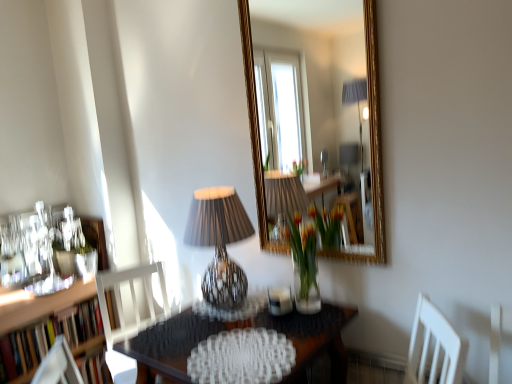
Question: From a real-world perspective, is translucent glass vase at center located higher than matte black lampshade at center?

Choices:
 (A) no
 (B) yes

Answer: (A)

Question: Does translucent glass vase at center appear on the left side of matte black lampshade at center?

Choices:
 (A) no
 (B) yes

Answer: (A)

Question: From the image's perspective, is translucent glass vase at center on top of matte black lampshade at center?

Choices:
 (A) yes
 (B) no

Answer: (B)

Question: Can you confirm if translucent glass vase at center is smaller than matte black lampshade at center?

Choices:
 (A) no
 (B) yes

Answer: (B)

Question: Is translucent glass vase at center oriented away from matte black lampshade at center?

Choices:
 (A) no
 (B) yes

Answer: (A)

Question: Is translucent glass vase at center taller than matte black lampshade at center?

Choices:
 (A) no
 (B) yes

Answer: (A)

Question: Is translucent glass vase at center shorter than matte black picture frame at left?

Choices:
 (A) no
 (B) yes

Answer: (A)

Question: Is translucent glass vase at center oriented away from matte black picture frame at left?

Choices:
 (A) yes
 (B) no

Answer: (B)

Question: From a real-world perspective, is translucent glass vase at center on top of matte black picture frame at left?

Choices:
 (A) yes
 (B) no

Answer: (A)

Question: Is matte black picture frame at left surrounded by translucent glass vase at center?

Choices:
 (A) no
 (B) yes

Answer: (A)

Question: Is translucent glass vase at center directly adjacent to matte black picture frame at left?

Choices:
 (A) yes
 (B) no

Answer: (B)

Question: From the image's perspective, is translucent glass vase at center over matte black picture frame at left?

Choices:
 (A) no
 (B) yes

Answer: (B)

Question: From a real-world perspective, is wooden bookshelf at left located beneath matte black lampshade at center?

Choices:
 (A) yes
 (B) no

Answer: (A)